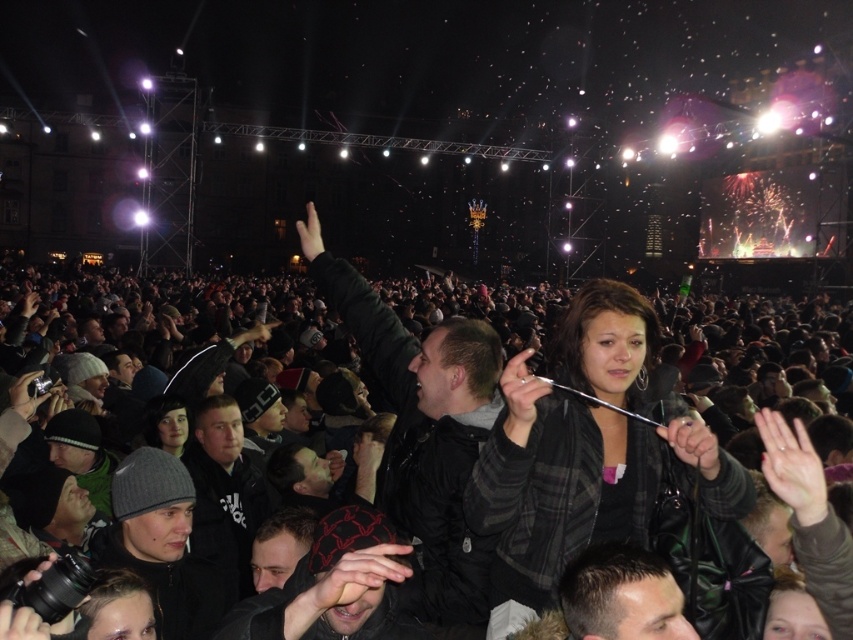
Does point (187, 305) come farther from viewer compared to point (497, 524)?

Yes, point (187, 305) is farther from viewer.

Who is shorter, black leather jacket at center or plaid fabric jacket at center?

plaid fabric jacket at center is shorter.

At what (x,y) coordinates should I click in order to perform the action: click on black leather jacket at center. Please return your answer as a coordinate pair (x, y). This screenshot has height=640, width=853. Looking at the image, I should click on pos(720,529).